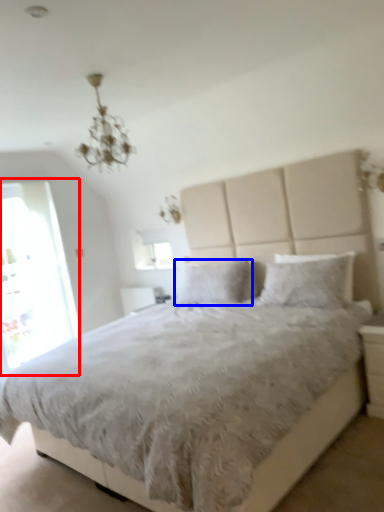
Question: Among these objects, which one is farthest to the camera, glass door (highlighted by a red box) or pillow (highlighted by a blue box)?

Choices:
 (A) glass door
 (B) pillow

Answer: (A)